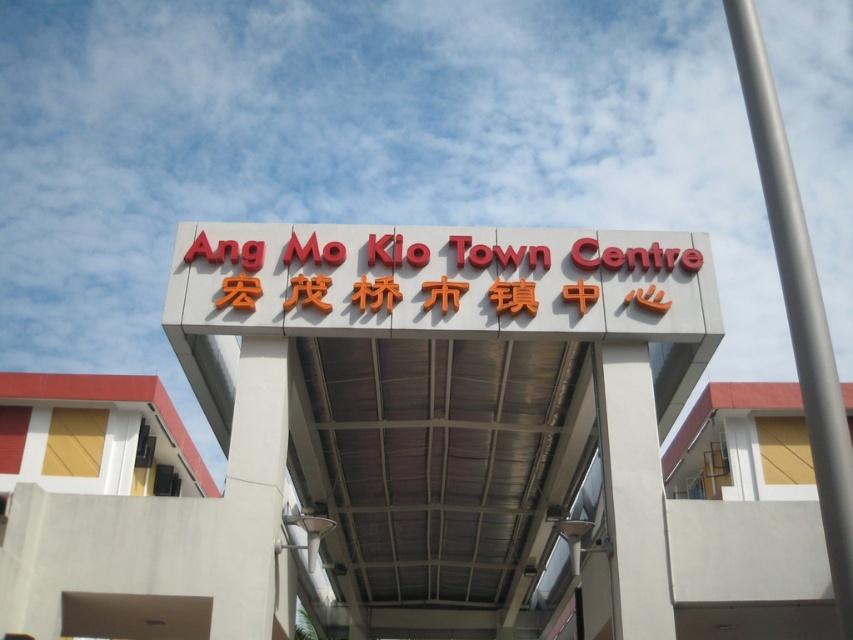
Looking at this image, can you confirm if silver metallic pole at upper right is positioned below red plastic sign at center?

Correct, silver metallic pole at upper right is located below red plastic sign at center.

Locate an element on the screen. This screenshot has width=853, height=640. silver metallic pole at upper right is located at coordinates (799, 304).

Is point (781, 188) closer to viewer compared to point (512, 256)?

Yes, point (781, 188) is in front of point (512, 256).

Locate an element on the screen. This screenshot has width=853, height=640. silver metallic pole at upper right is located at coordinates (799, 304).

Can you confirm if white matte sign at center is smaller than silver metallic pole at upper right?

No, white matte sign at center is not smaller than silver metallic pole at upper right.

Is point (312, 333) more distant than point (844, 620)?

Yes, point (312, 333) is behind point (844, 620).

Is point (531, 353) less distant than point (758, 154)?

No, it is not.

Find the location of a particular element. white matte sign at center is located at coordinates (425, 451).

Who is taller, white matte sign at center or red plastic sign at center?

With more height is white matte sign at center.

Does white matte sign at center have a greater width compared to red plastic sign at center?

Yes.

Is point (689, 280) closer to camera compared to point (456, 301)?

No, (689, 280) is further to viewer.

I want to click on white matte sign at center, so click(425, 451).